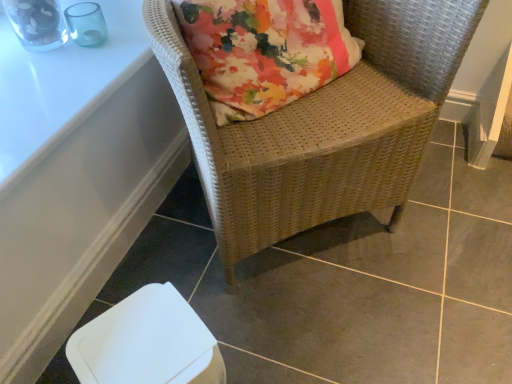
Question: Is the position of white glossy table at upper left, the 2th table when ordered from bottom to top, less distant than that of white plastic swivel chair at lower left?

Choices:
 (A) yes
 (B) no

Answer: (B)

Question: Is white glossy table at upper left, arranged as the first table when viewed from the top, oriented towards white plastic swivel chair at lower left?

Choices:
 (A) no
 (B) yes

Answer: (A)

Question: Can you confirm if white glossy table at upper left, arranged as the first table when viewed from the top, is shorter than white plastic swivel chair at lower left?

Choices:
 (A) no
 (B) yes

Answer: (B)

Question: Is white glossy table at upper left, the 2th table when ordered from bottom to top, far away from white plastic swivel chair at lower left?

Choices:
 (A) no
 (B) yes

Answer: (A)

Question: Is white glossy table at upper left, the 2th table when ordered from bottom to top, smaller than white plastic swivel chair at lower left?

Choices:
 (A) yes
 (B) no

Answer: (A)

Question: Looking at their shapes, would you say white glossy table at upper left, arranged as the first table when viewed from the top, is wider or thinner than white plastic table at lower left, positioned as the first table in bottom-to-top order?

Choices:
 (A) wide
 (B) thin

Answer: (A)

Question: Does point (73, 49) appear closer or farther from the camera than point (102, 57)?

Choices:
 (A) farther
 (B) closer

Answer: (A)

Question: Would you say white glossy table at upper left, the 2th table when ordered from bottom to top, is to the left or to the right of white plastic table at lower left, positioned as the first table in bottom-to-top order, in the picture?

Choices:
 (A) left
 (B) right

Answer: (A)

Question: Is white glossy table at upper left, the 2th table when ordered from bottom to top, inside or outside of white plastic table at lower left, positioned as the first table in bottom-to-top order?

Choices:
 (A) inside
 (B) outside

Answer: (B)

Question: In terms of width, does white plastic swivel chair at lower left look wider or thinner when compared to woven wicker chair at upper right?

Choices:
 (A) wide
 (B) thin

Answer: (B)

Question: Is white plastic swivel chair at lower left inside the boundaries of woven wicker chair at upper right, or outside?

Choices:
 (A) inside
 (B) outside

Answer: (B)

Question: Considering the positions of white plastic swivel chair at lower left and woven wicker chair at upper right in the image, is white plastic swivel chair at lower left bigger or smaller than woven wicker chair at upper right?

Choices:
 (A) small
 (B) big

Answer: (A)

Question: Is point (170, 294) positioned closer to the camera than point (402, 13)?

Choices:
 (A) farther
 (B) closer

Answer: (B)

Question: From the image's perspective, is white plastic swivel chair at lower left located above or below white glossy table at upper left, arranged as the first table when viewed from the top?

Choices:
 (A) below
 (B) above

Answer: (A)

Question: Relative to white glossy table at upper left, the 2th table when ordered from bottom to top, is white plastic swivel chair at lower left in front or behind?

Choices:
 (A) behind
 (B) front

Answer: (B)